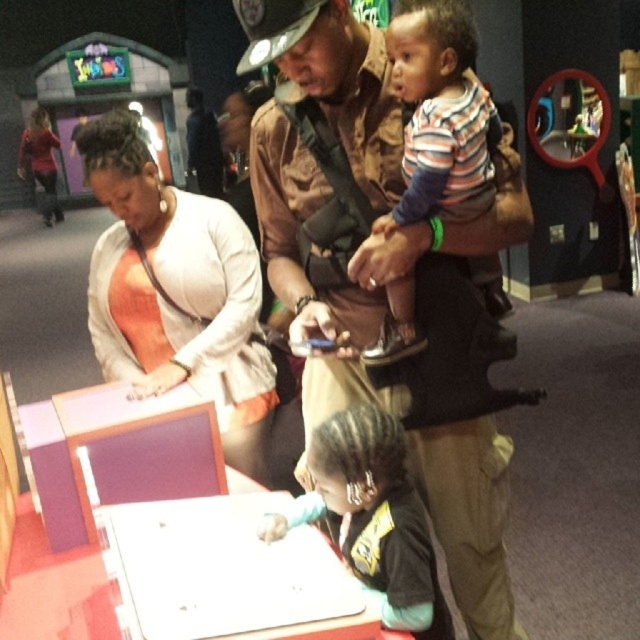
Does brown leather jacket at center have a lesser height compared to black fabric shirt at lower center?

No, brown leather jacket at center is not shorter than black fabric shirt at lower center.

Between point (273, 204) and point (364, 524), which one is positioned behind?

The point (273, 204) is more distant.

This screenshot has height=640, width=640. Identify the location of brown leather jacket at center. (342, 189).

Does brown leather jacket at center have a greater width compared to orange fabric shirt at center?

Correct, the width of brown leather jacket at center exceeds that of orange fabric shirt at center.

Looking at this image, can you confirm if brown leather jacket at center is smaller than orange fabric shirt at center?

Incorrect, brown leather jacket at center is not smaller in size than orange fabric shirt at center.

You are a GUI agent. You are given a task and a screenshot of the screen. Output one action in this format:
    pyautogui.click(x=<x>, y=<y>)
    Task: Click on the brown leather jacket at center
    This screenshot has height=640, width=640.
    Given the screenshot: What is the action you would take?
    pyautogui.click(x=342, y=189)

The width and height of the screenshot is (640, 640). In order to click on brown leather jacket at center in this screenshot , I will do `click(342, 189)`.

Between striped cotton shirt at upper center and black fabric shirt at lower center, which one has less height?

With less height is black fabric shirt at lower center.

Find the location of `striped cotton shirt at upper center`. striped cotton shirt at upper center is located at coordinates [440, 115].